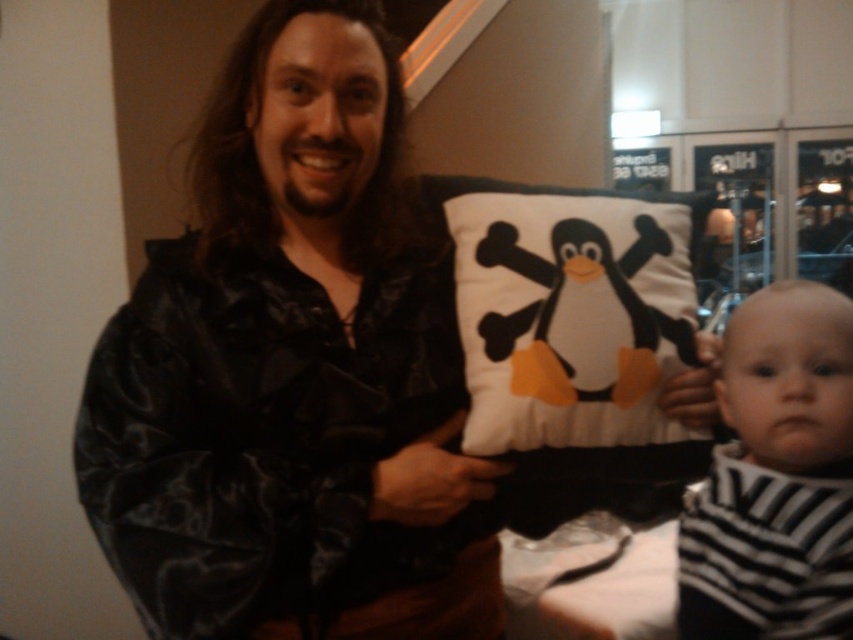
You are organizing a baby shower and need to place the white fabric pillow at center and the black and white striped bib at lower right on a small shelf. The shelf can only hold items that are no more than 30 cm in height. Can both items fit on the shelf if the pillow is 25 cm tall and the bib is 15 cm tall?

The white fabric pillow at center is 25 cm tall and the black and white striped bib at lower right is 15 cm tall. Since both are under the 30 cm height limit, they can both fit on the shelf.

You are a photographer setting up for a family photo. You need to place a prop between the white fabric pillow at center and the black and white striped bib at lower right. Where should you place it to ensure it is between them?

The white fabric pillow at center is positioned on the left side of the black and white striped bib at lower right, so placing the prop between them would require placing it to the right of the white fabric pillow at center and to the left of the black and white striped bib at lower right.

You are trying to locate the white fabric pillow at center in the image. Based on the coordinates provided, where exactly is it positioned?

The white fabric pillow at center is located at point 0.489 along the x axis and 0.671 along the y axis.